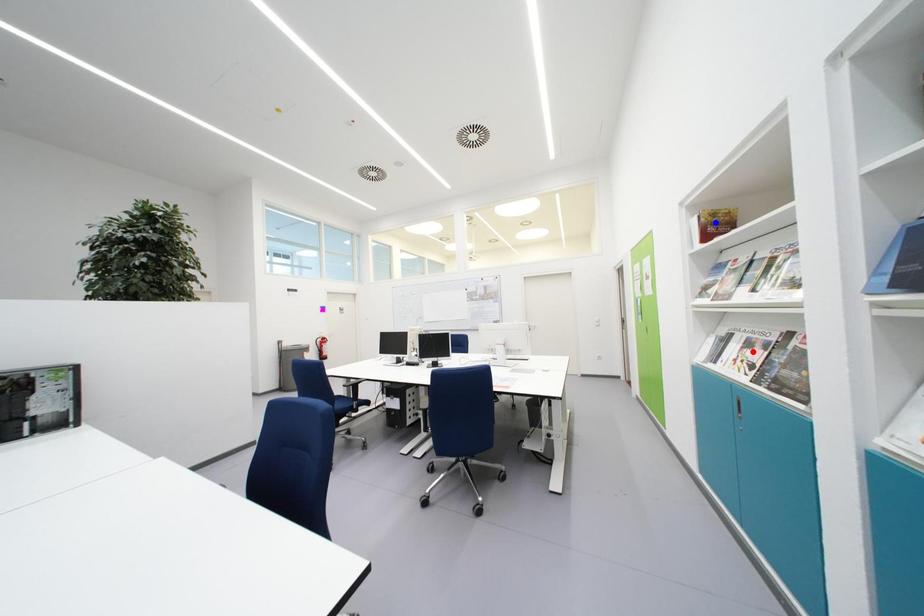
Question: Two points are marked on the image. Which point is closer to the camera?

Choices:
 (A) Blue point is closer.
 (B) Red point is closer.

Answer: (B)